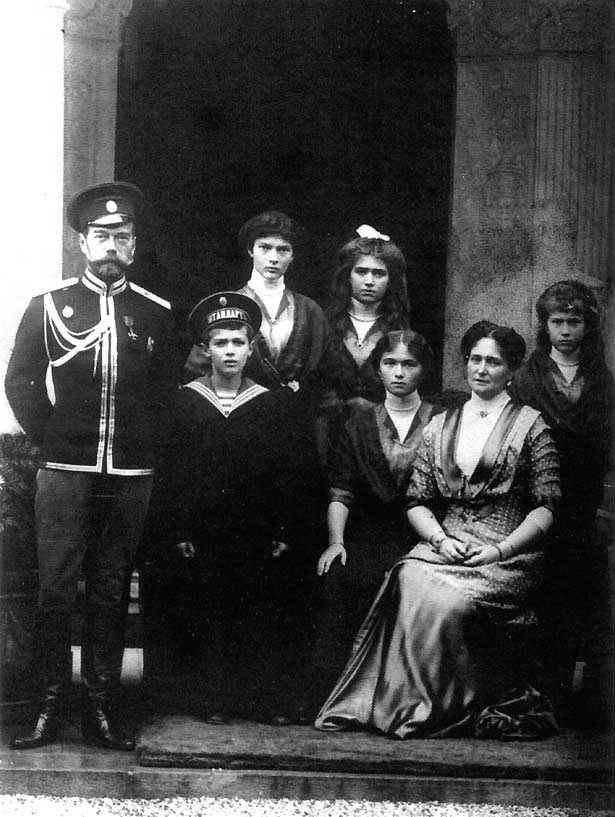
At what (x,y) coordinates should I click in order to perform the action: click on wall. Please return your answer as a coordinate pair (x, y). This screenshot has width=615, height=817. Looking at the image, I should click on (526, 248).